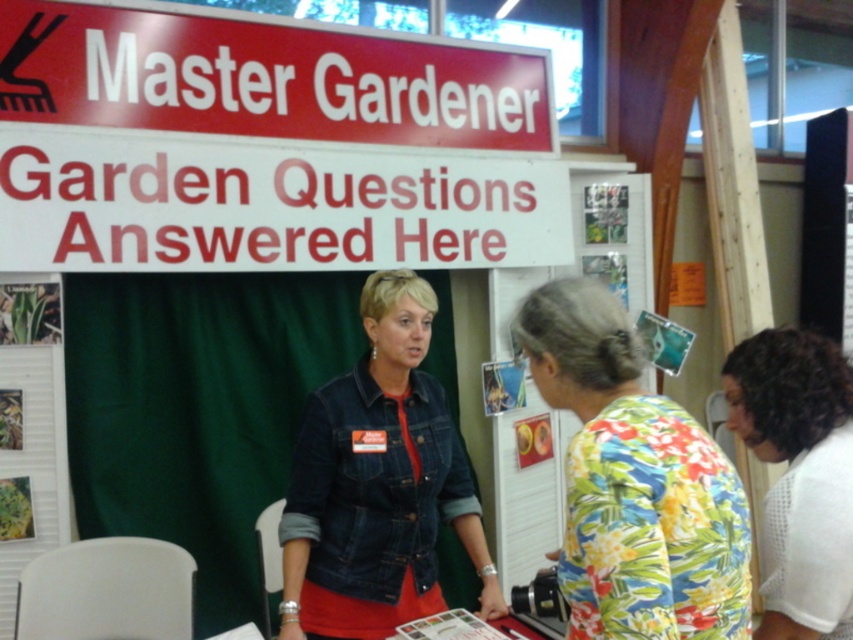
Between denim jacket at center and floral print blouse at lower right, which one appears on the right side from the viewer's perspective?

From the viewer's perspective, floral print blouse at lower right appears more on the right side.

Is denim jacket at center below floral print blouse at lower right?

Correct, denim jacket at center is located below floral print blouse at lower right.

What do you see at coordinates (378, 484) in the screenshot? I see `denim jacket at center` at bounding box center [378, 484].

Find the location of a particular element. This screenshot has width=853, height=640. denim jacket at center is located at coordinates (378, 484).

Does point (747, 410) come in front of point (7, 400)?

Yes.

The image size is (853, 640). What are the coordinates of `floral print blouse at lower right` in the screenshot? It's located at pyautogui.click(x=799, y=476).

Locate an element on the screen. Image resolution: width=853 pixels, height=640 pixels. floral print blouse at lower right is located at coordinates (799, 476).

In the scene shown: Between floral print shirt at center and denim jacket at center, which one has less height?

With less height is floral print shirt at center.

Between point (595, 308) and point (379, 371), which one is positioned in front?

Point (595, 308) is in front.

Who is more distant from viewer, (543,358) or (373,413)?

The point (373,413) is behind.

I want to click on floral print shirt at center, so click(633, 483).